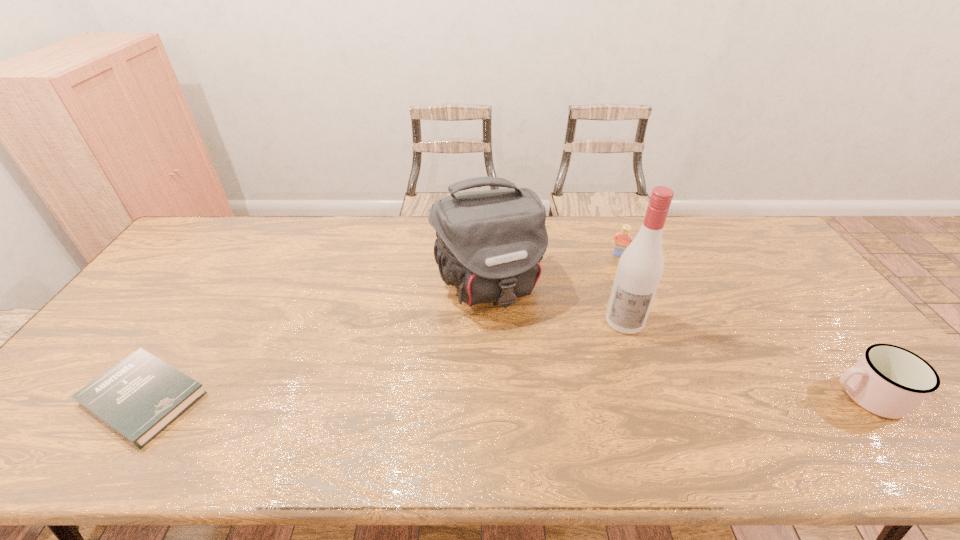
Locate an element on the screen. vacant space on the desktop that is between the book and the mug and is positioned on the open flap of the second object from left to right is located at coordinates (538, 397).

Locate an element on the screen. free space on the desktop that is between the shortest object and the mug and is positioned on the label of the alcohol is located at coordinates (610, 396).

Image resolution: width=960 pixels, height=540 pixels. I want to click on free space on the desktop that is between the book and the mug and is positioned on the front-facing side of the Lego, so click(571, 397).